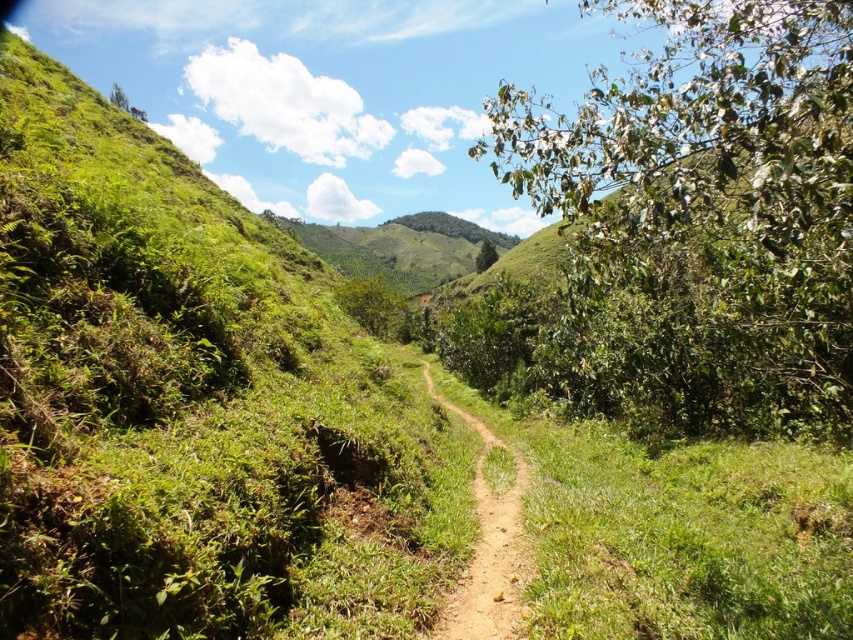
You are a hiker planning to walk from the green leafy bush at right to the green leafy hill at center. Given that your average walking speed is 3 miles per hour, approximately how many minutes will it take you to reach the hill?

The distance between the green leafy bush at right and the green leafy hill at center is 319.10 feet. Converting this distance to miles, 319.10 feet is approximately 0.06 miles. At a walking speed of 3 miles per hour, it would take roughly 0.06 divided by 3 equals 0.02 hours, which is about 1.2 minutes. Therefore, it would take approximately 1 minute to reach the hill.

You are a hiker planning to walk along the brown dirt track at center and the green leafy hill at center. Which object is lower in elevation?

The brown dirt track at center is located below the green leafy hill at center, so it has a lower elevation.

You are standing at the starting point of the dirt path in the image. There is a green leafy bush at right. Can you determine the direction of the bush relative to your position?

The green leafy bush at right is located at point 0.342 along the x and 0.824 along the y, which means it is positioned to the right side of your current position on the path.